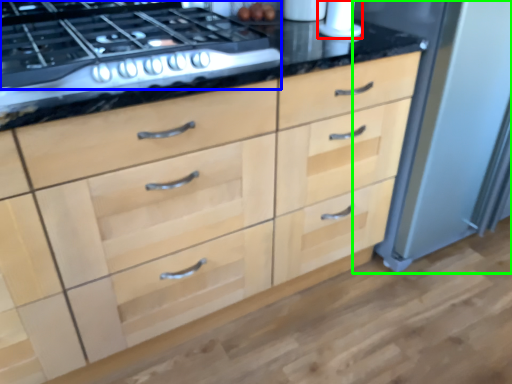
Question: Which object is the closest to the appliance (highlighted by a red box)? Choose among these: gas stove (highlighted by a blue box) or appliance (highlighted by a green box).

Choices:
 (A) gas stove
 (B) appliance

Answer: (B)